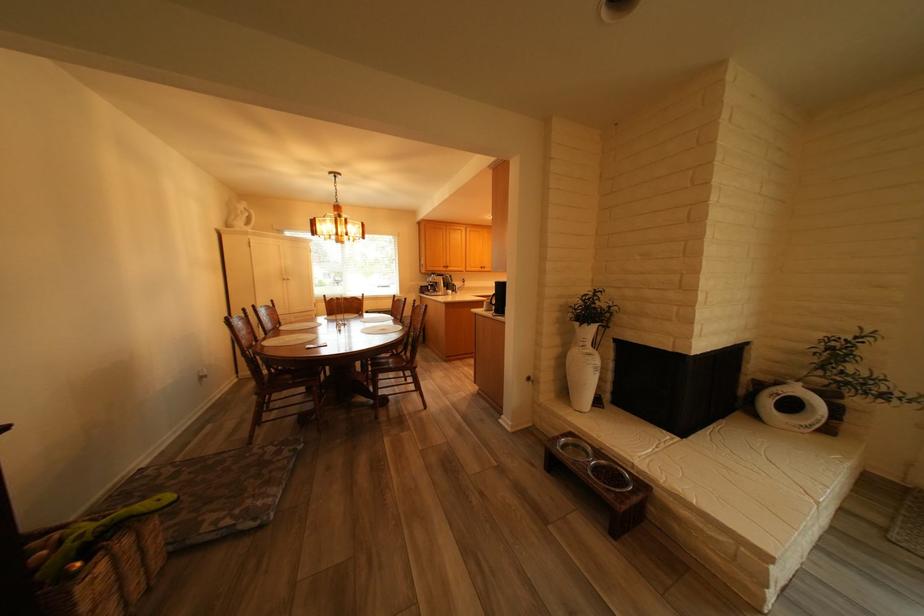
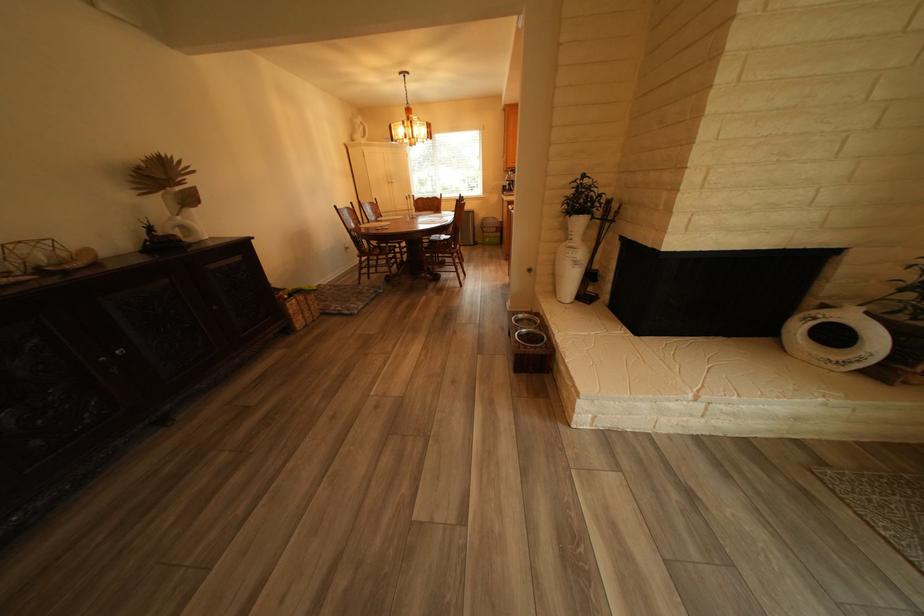
Locate, in the second image, the point that corresponds to pixel 276 374 in the first image.

(379, 246)